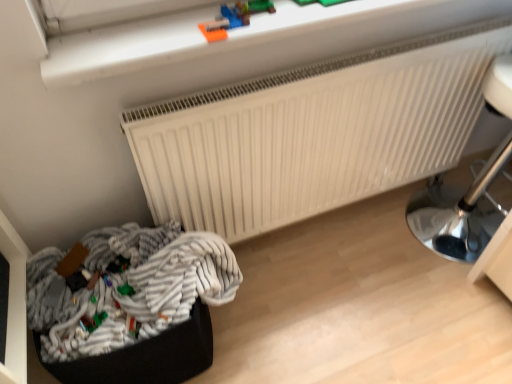
In order to click on vacant region to the left of metallic silver lamp at right in this screenshot , I will do `click(380, 250)`.